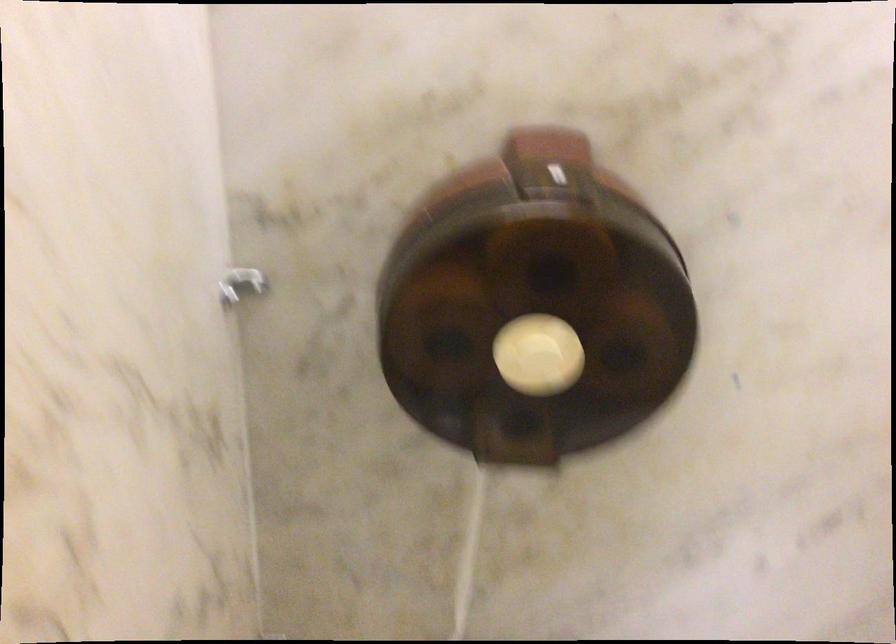
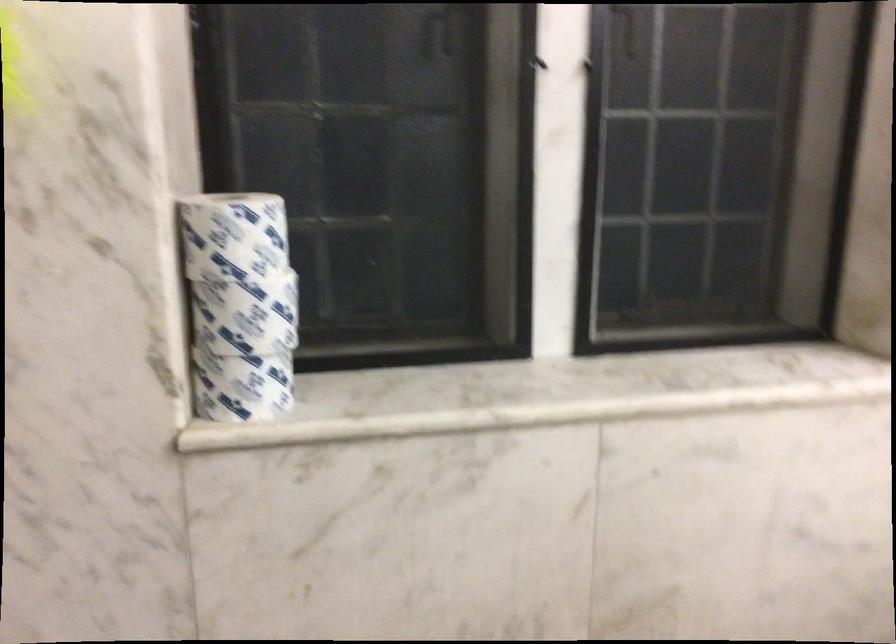
First-person continuous shooting, in which direction is the camera rotating?

The rotation direction of the camera is right-down.